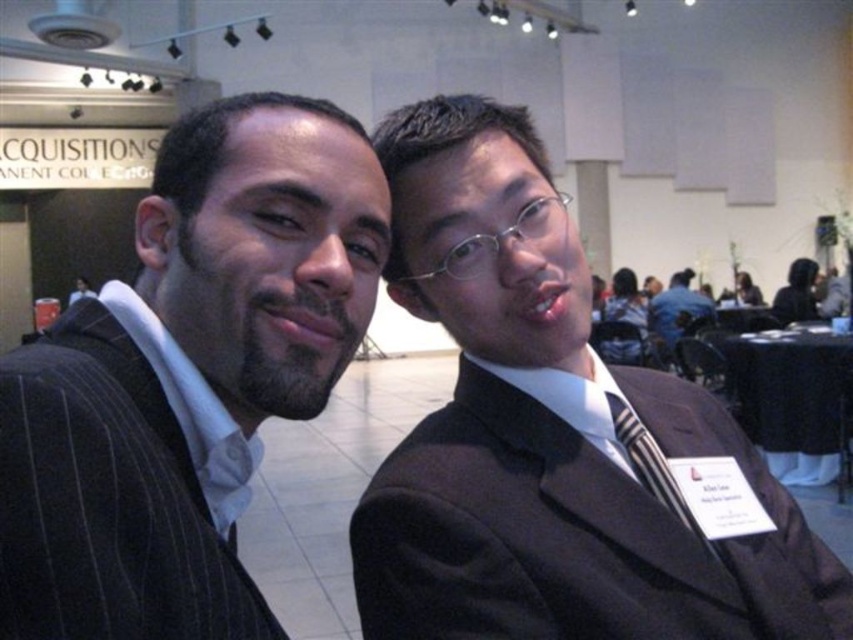
Can you confirm if dark pinstripe suit at left is wider than pinstriped wool suit at left?

Yes.

Can you confirm if dark pinstripe suit at left is positioned to the right of pinstriped wool suit at left?

Indeed, dark pinstripe suit at left is positioned on the right side of pinstriped wool suit at left.

Which is in front, point (306, 284) or point (80, 470)?

Point (80, 470) is more forward.

This screenshot has width=853, height=640. What are the coordinates of `dark pinstripe suit at left` in the screenshot? It's located at (186, 376).

Does point (86, 314) come closer to viewer compared to point (659, 305)?

Yes, point (86, 314) is in front of point (659, 305).

Is point (210, 632) farther from camera compared to point (672, 304)?

No, it is not.

Find the location of a particular element. The width and height of the screenshot is (853, 640). dark pinstripe suit at left is located at coordinates 186,376.

Describe the element at coordinates (576, 531) in the screenshot. This screenshot has height=640, width=853. I see `dark brown pinstripe suit at center` at that location.

Between dark brown pinstripe suit at center and striped fabric tie at center, which one appears on the right side from the viewer's perspective?

striped fabric tie at center

Describe the element at coordinates (576, 531) in the screenshot. I see `dark brown pinstripe suit at center` at that location.

Locate an element on the screen. dark brown pinstripe suit at center is located at coordinates (576, 531).